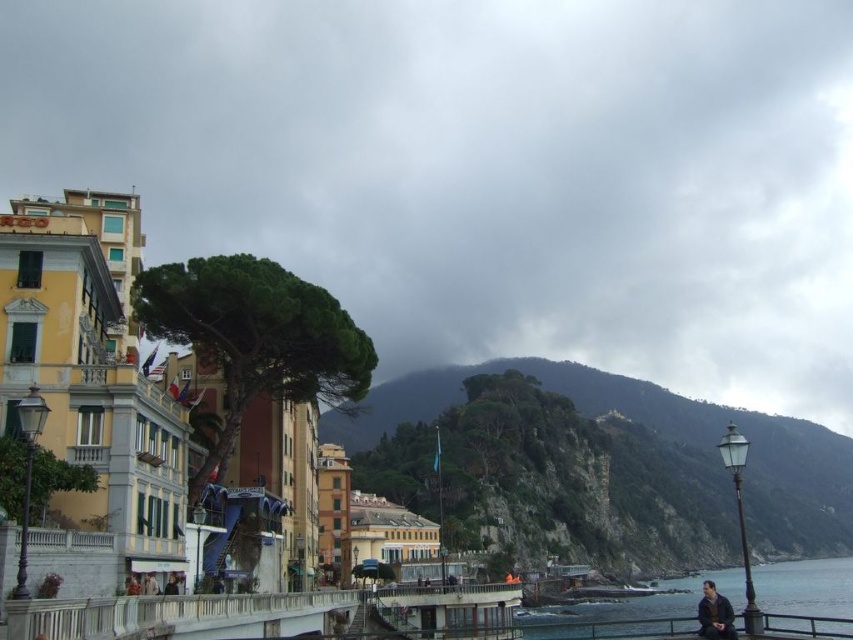
You are standing at the point marked as point (636, 609) in the coastal scene. What is the closest major landmark to your current location?

The closest major landmark to point (636, 609) is the blue water at lower right, which is exactly at that coordinate.

You are standing on the walkway and want to reach the blue water at lower right. Which direction should you move relative to the dark blue fabric jacket at lower center?

The blue water at lower right is in front of the dark blue fabric jacket at lower center, so you should move towards the blue water at lower right in the direction away from the dark blue fabric jacket at lower center.

From the picture: You are a photographer planning to capture a closeup of the dark brown leather jacket at lower right and the dark blue fabric jacket at lower center. Since you want both jackets to appear similarly sized in the photo, which jacket should you move closer to the camera and by how much?

To make both jackets appear similarly sized in the photo, you should move the dark blue fabric jacket at lower center closer to the camera. Since the dark brown leather jacket at lower right is wider, moving the smaller dark blue fabric jacket at lower center closer will balance their apparent sizes. The exact distance needed depends on their actual sizes and current positions, but moving it about half the distance between them should help achieve the desired effect.